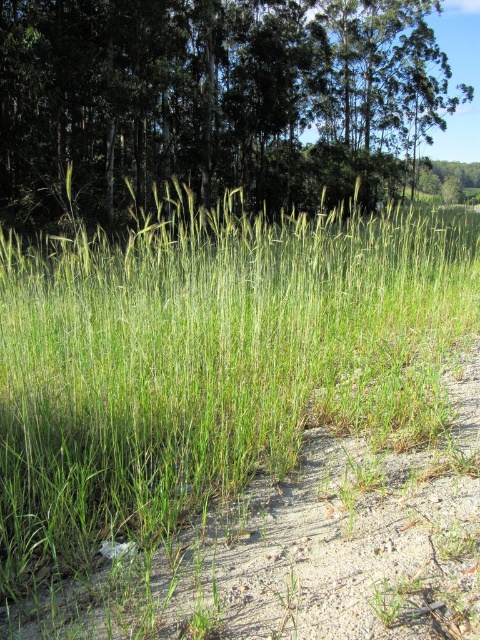
Question: Which point appears closest to the camera in this image?

Choices:
 (A) (332, 138)
 (B) (132, 465)

Answer: (B)

Question: Among these points, which one is farthest from the camera?

Choices:
 (A) [x=322, y=120]
 (B) [x=219, y=424]

Answer: (A)

Question: Which point appears farthest from the camera in this image?

Choices:
 (A) (67, 3)
 (B) (433, 307)

Answer: (A)

Question: Can you confirm if green grassy at center is smaller than green leafy tree at upper center?

Choices:
 (A) no
 (B) yes

Answer: (B)

Question: Does green grassy at center lie in front of green leafy tree at upper center?

Choices:
 (A) no
 (B) yes

Answer: (B)

Question: In this image, where is green grassy at center located relative to green leafy tree at upper center?

Choices:
 (A) left
 (B) right

Answer: (A)